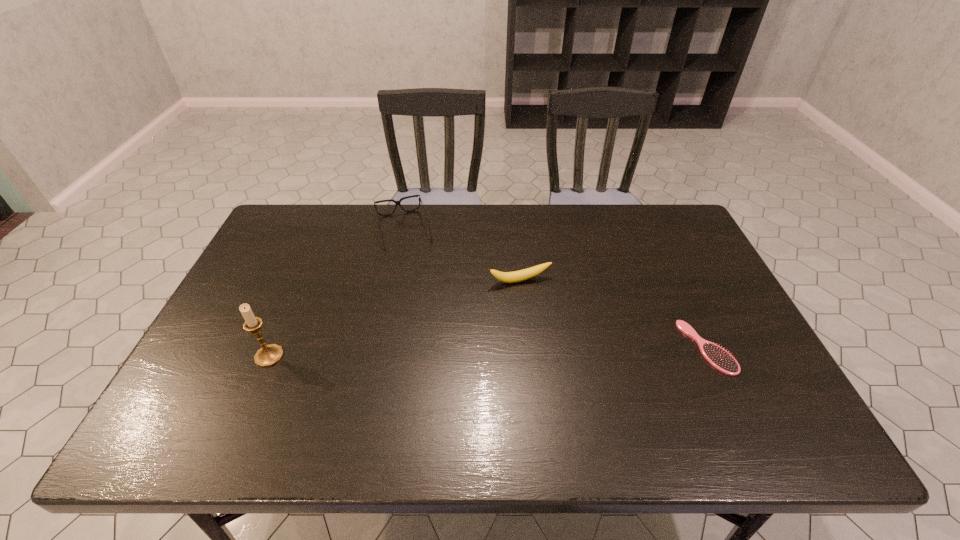
At what (x,y) coordinates should I click in order to perform the action: click on candle holder. Please return your answer as a coordinate pair (x, y). The height and width of the screenshot is (540, 960). Looking at the image, I should click on (268, 355).

You are a GUI agent. You are given a task and a screenshot of the screen. Output one action in this format:
    pyautogui.click(x=<x>, y=<y>)
    Task: Click on the tallest object
    
    Given the screenshot: What is the action you would take?
    pyautogui.click(x=268, y=355)

At what (x,y) coordinates should I click in order to perform the action: click on hairbrush. Please return your answer as a coordinate pair (x, y). The height and width of the screenshot is (540, 960). Looking at the image, I should click on (718, 357).

Locate an element on the screen. the shortest object is located at coordinates (718, 357).

Locate an element on the screen. Image resolution: width=960 pixels, height=540 pixels. the third object from left to right is located at coordinates (517, 276).

Where is `the third nearest object`? The height and width of the screenshot is (540, 960). the third nearest object is located at coordinates (517, 276).

In order to click on the farthest object in this screenshot , I will do `click(396, 202)`.

I want to click on spectacles, so pyautogui.click(x=396, y=202).

At what (x,y) coordinates should I click in order to perform the action: click on free space located 0.240m on the right of the tallest object. Please return your answer as a coordinate pair (x, y). Looking at the image, I should click on (380, 356).

You are a GUI agent. You are given a task and a screenshot of the screen. Output one action in this format:
    pyautogui.click(x=<x>, y=<y>)
    Task: Click on the vacant region located on the left of the hairbrush
    This screenshot has width=960, height=540.
    Given the screenshot: What is the action you would take?
    point(617,347)